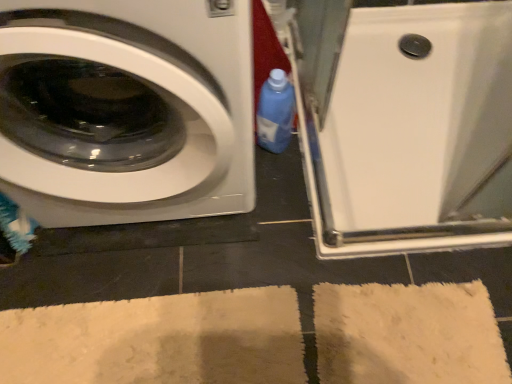
Question: Does white glossy shower tray at upper right have a smaller size compared to blue plastic bottle at center?

Choices:
 (A) yes
 (B) no

Answer: (B)

Question: From a real-world perspective, is white glossy shower tray at upper right located higher than blue plastic bottle at center?

Choices:
 (A) no
 (B) yes

Answer: (A)

Question: Does white glossy shower tray at upper right have a greater height compared to blue plastic bottle at center?

Choices:
 (A) yes
 (B) no

Answer: (B)

Question: Considering the relative positions of white glossy shower tray at upper right and blue plastic bottle at center in the image provided, is white glossy shower tray at upper right in front of blue plastic bottle at center?

Choices:
 (A) no
 (B) yes

Answer: (A)

Question: Could blue plastic bottle at center be considered to be inside white glossy shower tray at upper right?

Choices:
 (A) no
 (B) yes

Answer: (A)

Question: Is point (184, 190) closer or farther from the camera than point (440, 120)?

Choices:
 (A) closer
 (B) farther

Answer: (A)

Question: Based on their sizes in the image, would you say white glossy washing machine at left is bigger or smaller than white glossy shower tray at upper right?

Choices:
 (A) small
 (B) big

Answer: (B)

Question: In the image, is white glossy washing machine at left positioned in front of or behind white glossy shower tray at upper right?

Choices:
 (A) front
 (B) behind

Answer: (A)

Question: From the image's perspective, relative to white glossy shower tray at upper right, is white glossy washing machine at left above or below?

Choices:
 (A) below
 (B) above

Answer: (B)

Question: Visually, is blue plastic bottle at center positioned to the left or to the right of beige soft rug at lower center?

Choices:
 (A) right
 (B) left

Answer: (A)

Question: From the image's perspective, is blue plastic bottle at center located above or below beige soft rug at lower center?

Choices:
 (A) below
 (B) above

Answer: (B)

Question: Would you say blue plastic bottle at center is inside or outside beige soft rug at lower center?

Choices:
 (A) inside
 (B) outside

Answer: (B)

Question: Is blue plastic bottle at center wider or thinner than beige soft rug at lower center?

Choices:
 (A) thin
 (B) wide

Answer: (A)

Question: Considering their positions, is white glossy washing machine at left located in front of or behind beige soft rug at lower center?

Choices:
 (A) behind
 (B) front

Answer: (B)

Question: In terms of width, does white glossy washing machine at left look wider or thinner when compared to beige soft rug at lower center?

Choices:
 (A) wide
 (B) thin

Answer: (B)